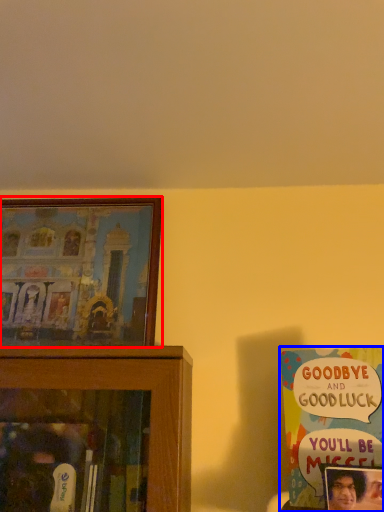
Question: Which object appears closest to the camera in this image, picture frame (highlighted by a red box) or book (highlighted by a blue box)?

Choices:
 (A) picture frame
 (B) book

Answer: (B)